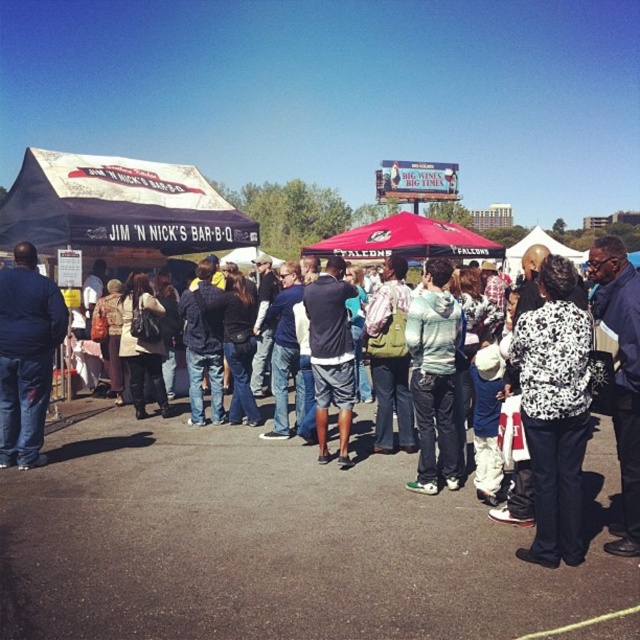
Which is behind, point (125, 243) or point (412, 324)?

The point (125, 243) is behind.

Is white canvas tent at left further to the viewer compared to light blue hoodie at center?

That is True.

Which is behind, point (232, 236) or point (419, 474)?

Positioned behind is point (232, 236).

What are the coordinates of `white canvas tent at left` in the screenshot? It's located at (116, 205).

Looking at this image, does white printed sweater at center appear on the left side of light blue hoodie at center?

In fact, white printed sweater at center is to the right of light blue hoodie at center.

Does white printed sweater at center appear over light blue hoodie at center?

Actually, white printed sweater at center is below light blue hoodie at center.

This screenshot has height=640, width=640. Find the location of `white printed sweater at center`. white printed sweater at center is located at coordinates 554,412.

Locate an element on the screen. This screenshot has width=640, height=640. white printed sweater at center is located at coordinates (554, 412).

Who is more distant from viewer, [180,243] or [312,364]?

Positioned behind is point [180,243].

Does point (60, 168) come behind point (321, 330)?

Yes.

You are a GUI agent. You are given a task and a screenshot of the screen. Output one action in this format:
    pyautogui.click(x=<x>, y=<y>)
    Task: Click on the white canvas tent at left
    
    Given the screenshot: What is the action you would take?
    pyautogui.click(x=116, y=205)